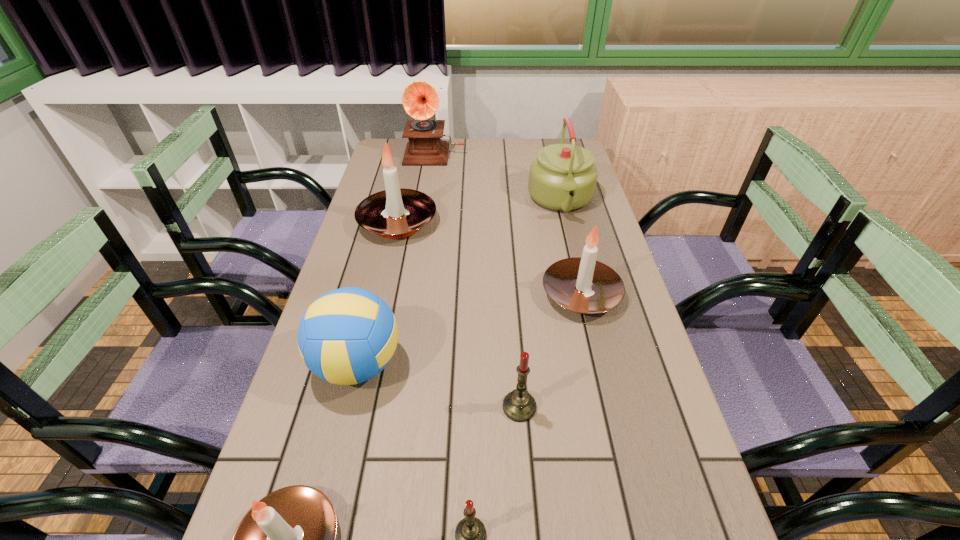
Identify the location of free space located on the back of the farthest candle. (415, 147).

The height and width of the screenshot is (540, 960). I want to click on vacant region located 0.330m at the spout of the kettle, so click(x=587, y=305).

You are a GUI agent. You are given a task and a screenshot of the screen. Output one action in this format:
    pyautogui.click(x=<x>, y=<y>)
    Task: Click on the free region located on the back of the second farthest candle
    This screenshot has width=960, height=540.
    Given the screenshot: What is the action you would take?
    pyautogui.click(x=563, y=216)

At what (x,y) coordinates should I click in order to perform the action: click on blank space located on the right of the volleyball. Please return your answer as a coordinate pair (x, y). The width and height of the screenshot is (960, 540). Looking at the image, I should click on (483, 364).

The height and width of the screenshot is (540, 960). In order to click on vacant area located 0.130m on the right of the fourth candle from left to right in this screenshot , I will do `click(599, 407)`.

Where is `object that is at the far edge`? object that is at the far edge is located at coordinates (420, 100).

The height and width of the screenshot is (540, 960). I want to click on phonograph record that is at the left edge, so click(x=420, y=100).

At what (x,y) coordinates should I click in order to perform the action: click on candle that is at the left edge. Please return your answer as a coordinate pair (x, y). The width and height of the screenshot is (960, 540). Looking at the image, I should click on (396, 212).

At what (x,y) coordinates should I click in order to perform the action: click on volleyball situated at the left edge. Please return your answer as a coordinate pair (x, y). This screenshot has height=540, width=960. Looking at the image, I should click on (347, 336).

Where is `kettle present at the right edge`? kettle present at the right edge is located at coordinates (563, 177).